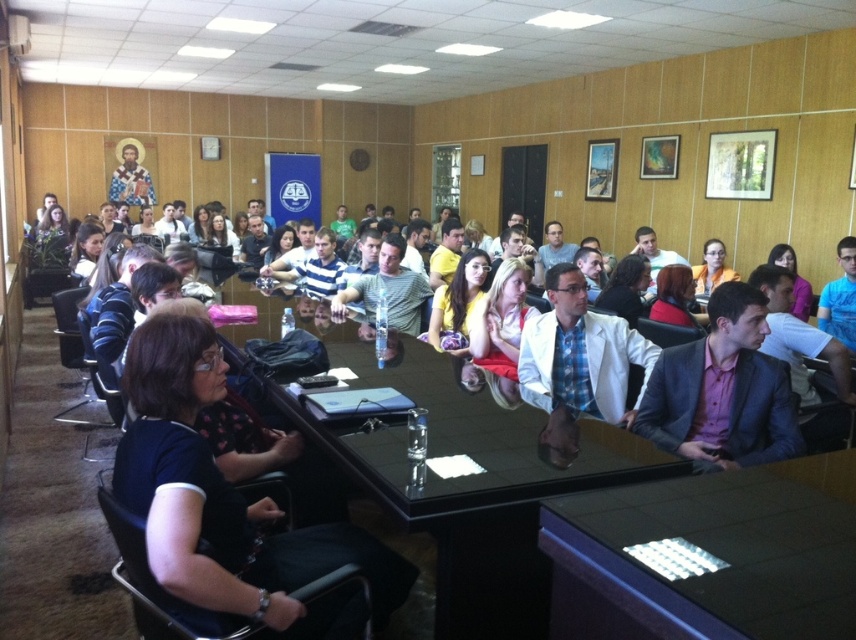
Does dark blue fabric shirt at lower left lie in front of yellow fabric dress at center?

Yes, dark blue fabric shirt at lower left is in front of yellow fabric dress at center.

Who is shorter, dark blue fabric shirt at lower left or yellow fabric dress at center?

yellow fabric dress at center

I want to click on dark blue fabric shirt at lower left, so click(227, 500).

Is black glossy table at lower right thinner than dark blue fabric shirt at lower left?

No.

Does black glossy table at lower right have a larger size compared to dark blue fabric shirt at lower left?

No.

Locate an element on the screen. black glossy table at lower right is located at coordinates (709, 557).

Between point (800, 454) and point (379, 257), which one is positioned in front?

Point (800, 454) is more forward.

Can you confirm if pink fabric shirt at center is taller than matte gray shirt at center?

No.

Does point (752, 307) come farther from viewer compared to point (411, 304)?

That is False.

This screenshot has height=640, width=856. Identify the location of pink fabric shirt at center. pyautogui.click(x=723, y=390).